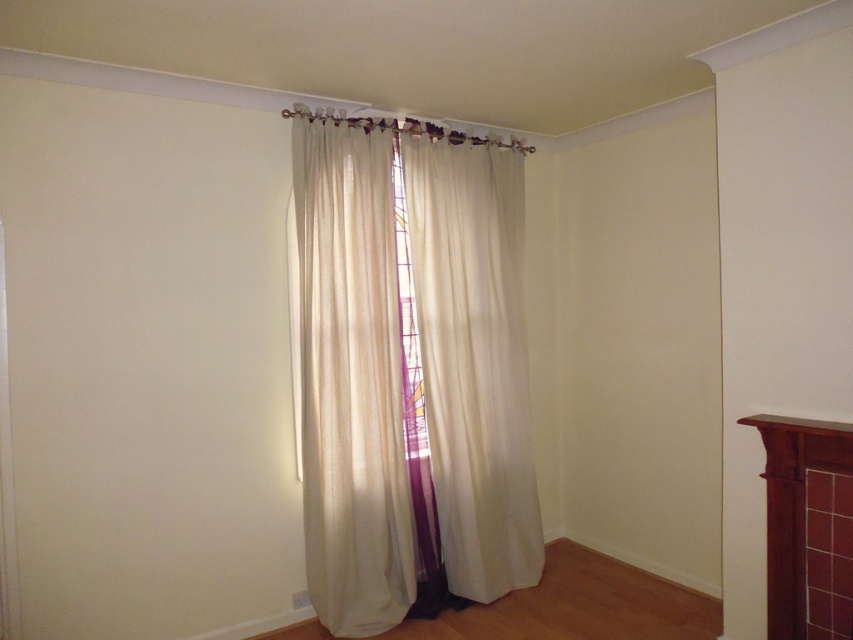
You are planning to place a large painting on the wall between the brown wood fireplace at right and the transparent glass window at center. Which object should the painting be closer to if you want it to be more visible from the main seating area?

The painting should be placed closer to the transparent glass window at center because it is smaller than the brown wood fireplace at right, allowing for better visibility from the main seating area.

You are standing in the corner of the room with the minimalist design. You want to locate the brown wood fireplace at right. Where exactly is it positioned in the room?

The brown wood fireplace at right is positioned at point (793, 506) in the room.